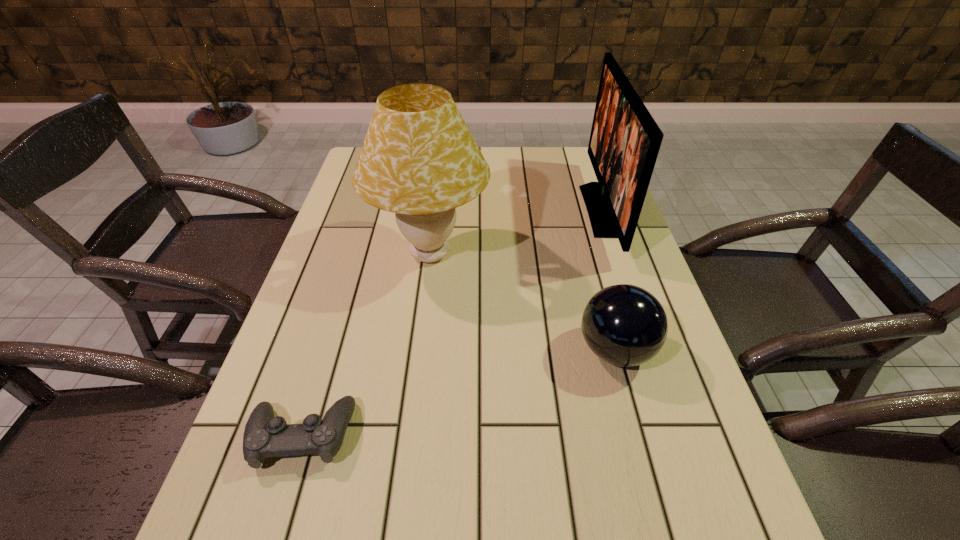
Locate an element on the screen. The height and width of the screenshot is (540, 960). vacant space positioned on the side of the third tallest object with the finger holes is located at coordinates 391,350.

In order to click on vacant space located 0.120m on the side of the third tallest object with the finger holes in this screenshot , I will do `click(519, 350)`.

Find the location of a particular element. The width and height of the screenshot is (960, 540). vacant space located on the side of the third tallest object with the finger holes is located at coordinates (481, 350).

At what (x,y) coordinates should I click in order to perform the action: click on vacant space located on the right of the shortest object. Please return your answer as a coordinate pair (x, y). This screenshot has width=960, height=540. Looking at the image, I should click on (402, 435).

The height and width of the screenshot is (540, 960). I want to click on object that is positioned at the far edge, so click(x=625, y=140).

Locate an element on the screen. lampshade located in the left edge section of the desktop is located at coordinates (419, 160).

Identify the location of control situated at the left edge. (265, 436).

Where is `monitor located in the right edge section of the desktop`? monitor located in the right edge section of the desktop is located at coordinates (625, 140).

This screenshot has height=540, width=960. Identify the location of bowling ball that is at the right edge. (624, 325).

What are the coordinates of `object positioned at the far right corner` in the screenshot? It's located at (625, 140).